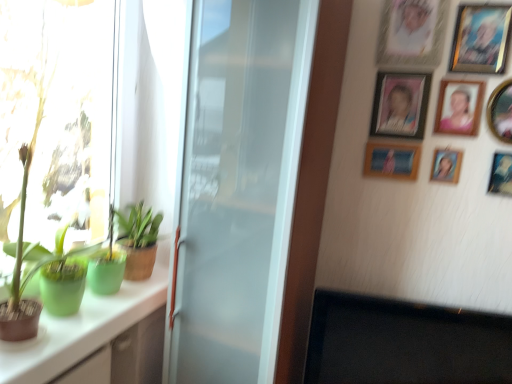
Question: Is wooden picture frame at upper right, which is counted as the 2th picture frame, starting from the top, further to camera compared to wooden photo frame at upper right, which is the 6th picture frame from bottom to top?

Choices:
 (A) yes
 (B) no

Answer: (B)

Question: Are wooden picture frame at upper right, which is counted as the 2th picture frame, starting from the top, and wooden photo frame at upper right, the 3th picture frame when ordered from top to bottom, far apart?

Choices:
 (A) no
 (B) yes

Answer: (A)

Question: Can wooden photo frame at upper right, which is the 6th picture frame from bottom to top, be found inside wooden picture frame at upper right, which is the seventh picture frame from bottom to top?

Choices:
 (A) no
 (B) yes

Answer: (A)

Question: Does wooden picture frame at upper right, which is counted as the 2th picture frame, starting from the top, appear on the right side of wooden photo frame at upper right, the 3th picture frame when ordered from top to bottom?

Choices:
 (A) no
 (B) yes

Answer: (B)

Question: From a real-world perspective, is wooden picture frame at upper right, which is the seventh picture frame from bottom to top, below wooden photo frame at upper right, the 3th picture frame when ordered from top to bottom?

Choices:
 (A) yes
 (B) no

Answer: (B)

Question: In terms of height, does green matte plant at left, acting as the third houseplant starting from the bottom, look taller or shorter compared to green matte plant at left, the first houseplant from the bottom?

Choices:
 (A) tall
 (B) short

Answer: (A)

Question: From a real-world perspective, is green matte plant at left, acting as the third houseplant starting from the bottom, positioned above or below green matte plant at left, which is the 3th houseplant from top to bottom?

Choices:
 (A) below
 (B) above

Answer: (B)

Question: Do you think green matte plant at left, acting as the 1th houseplant starting from the top, is within green matte plant at left, the first houseplant from the bottom, or outside of it?

Choices:
 (A) outside
 (B) inside

Answer: (A)

Question: From the image's perspective, is green matte plant at left, acting as the third houseplant starting from the bottom, positioned above or below green matte plant at left, the first houseplant from the bottom?

Choices:
 (A) below
 (B) above

Answer: (B)

Question: Considering the positions of matte plastic picture frame at upper right, the 5th picture frame in the bottom-to-top sequence, and white glossy cabinet at left in the image, is matte plastic picture frame at upper right, the 5th picture frame in the bottom-to-top sequence, wider or thinner than white glossy cabinet at left?

Choices:
 (A) thin
 (B) wide

Answer: (A)

Question: Based on their positions, is matte plastic picture frame at upper right, the 4th picture frame viewed from the top, located to the left or right of white glossy cabinet at left?

Choices:
 (A) left
 (B) right

Answer: (B)

Question: Relative to white glossy cabinet at left, is matte plastic picture frame at upper right, the 4th picture frame viewed from the top, in front or behind?

Choices:
 (A) behind
 (B) front

Answer: (A)

Question: Looking at the image, does matte plastic picture frame at upper right, the 5th picture frame in the bottom-to-top sequence, seem bigger or smaller compared to white glossy cabinet at left?

Choices:
 (A) big
 (B) small

Answer: (B)

Question: Looking at their shapes, would you say white glossy cabinet at left is wider or thinner than satin white refrigerator at center?

Choices:
 (A) thin
 (B) wide

Answer: (A)

Question: Considering the positions of point (110, 332) and point (231, 82), is point (110, 332) closer or farther from the camera than point (231, 82)?

Choices:
 (A) farther
 (B) closer

Answer: (A)